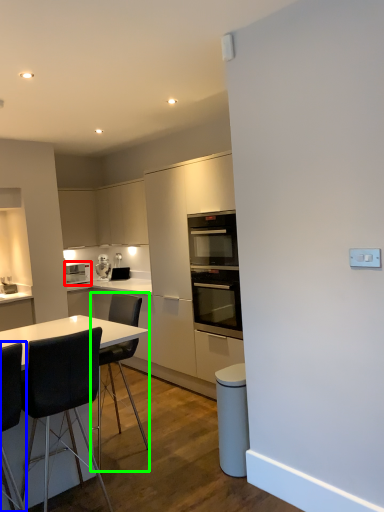
Question: Which is farther away from home appliance (highlighted by a red box)? chair (highlighted by a blue box) or chair (highlighted by a green box)?

Choices:
 (A) chair
 (B) chair

Answer: (A)